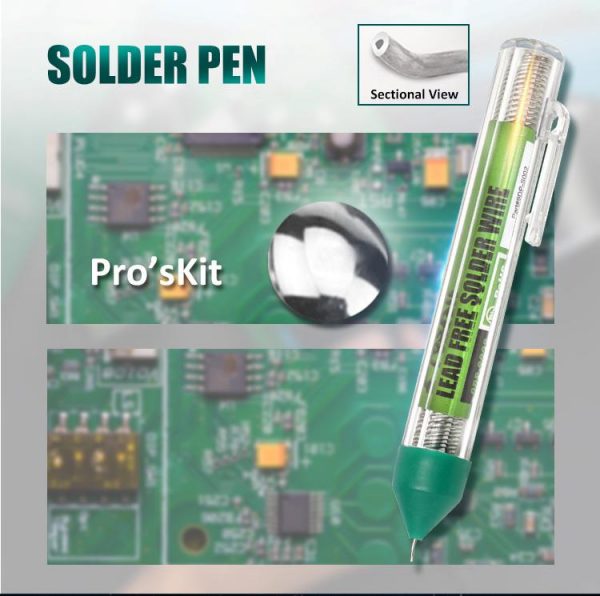
You are a GUI agent. You are given a task and a screenshot of the screen. Output one action in this format:
    pyautogui.click(x=<x>, y=<y>)
    Task: Click on the pen
    This screenshot has width=600, height=596.
    Given the screenshot: What is the action you would take?
    pyautogui.click(x=425, y=493)